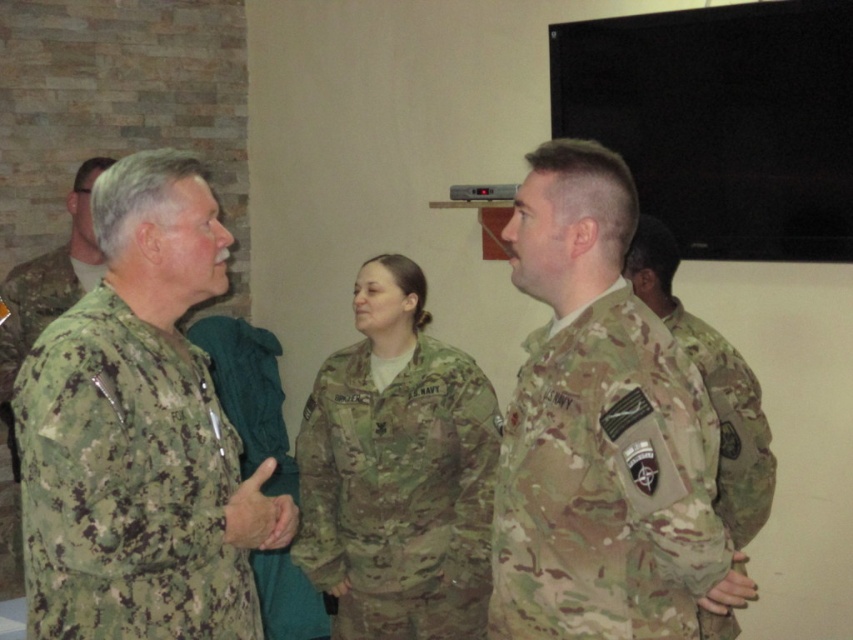
Question: Which of the following is the closest to the observer?

Choices:
 (A) (198, 627)
 (B) (764, 433)
 (C) (553, 387)
 (D) (380, 264)

Answer: (A)

Question: Which point is farther from the camera taking this photo?

Choices:
 (A) (728, 500)
 (B) (196, 548)

Answer: (A)

Question: In this image, where is camouflage fabric uniform at left located relative to camouflage fabric uniform at right?

Choices:
 (A) left
 (B) right

Answer: (A)

Question: Is camouflage uniform at right in front of camouflage fabric uniform at left?

Choices:
 (A) no
 (B) yes

Answer: (A)

Question: Which of the following is the farthest from the observer?

Choices:
 (A) camouflage uniform at right
 (B) camouflage uniform at center
 (C) camouflage fabric uniform at right

Answer: (B)

Question: Is camouflage uniform at right to the right of camouflage uniform at center from the viewer's perspective?

Choices:
 (A) yes
 (B) no

Answer: (A)